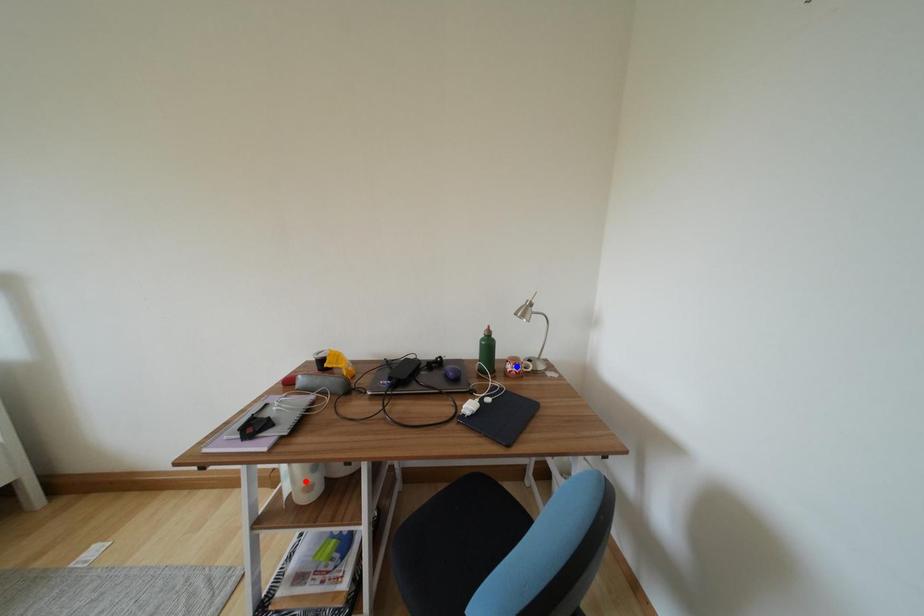
Question: Two points are marked on the image. Which point is closer to the camera?

Choices:
 (A) Blue point is closer.
 (B) Red point is closer.

Answer: (B)